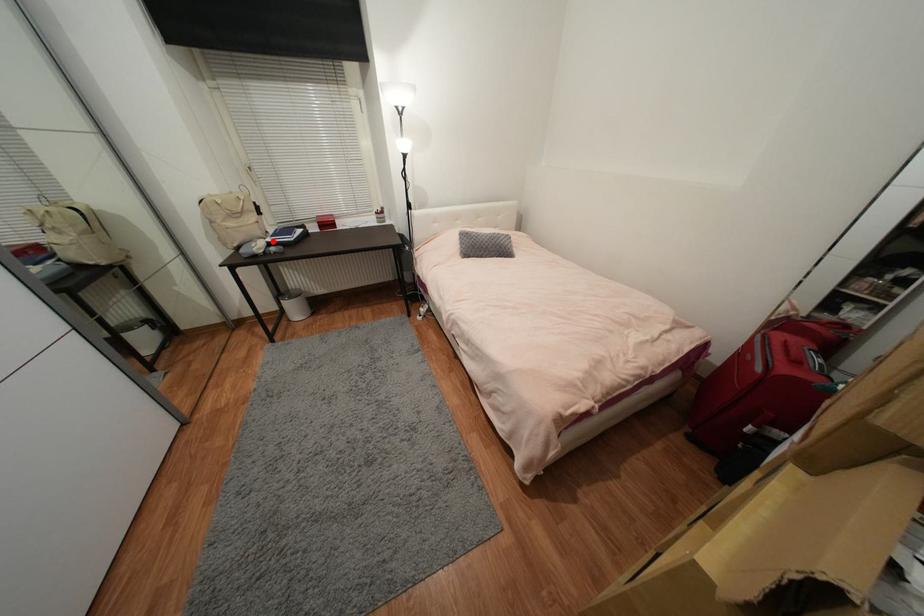
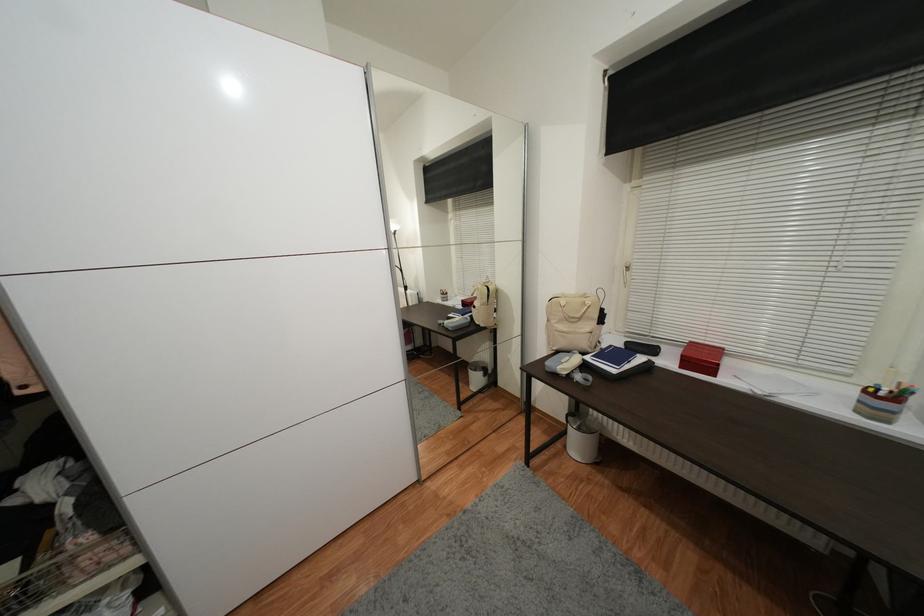
In the second image, find the point that corresponds to the highlighted location in the first image.

(592, 360)